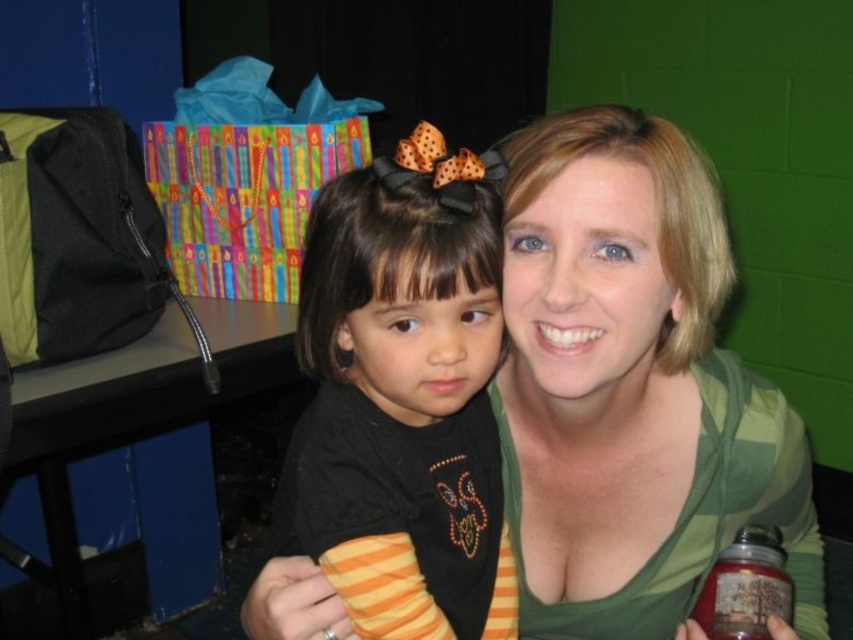
Question: Is green striped shirt at upper center below black matte shirt at center?

Choices:
 (A) yes
 (B) no

Answer: (A)

Question: Which of the following is the closest to the observer?

Choices:
 (A) green striped shirt at upper center
 (B) black matte shirt at center

Answer: (B)

Question: Is green striped shirt at upper center smaller than black matte shirt at center?

Choices:
 (A) yes
 (B) no

Answer: (B)

Question: Among these points, which one is nearest to the camera?

Choices:
 (A) (399, 541)
 (B) (509, 228)

Answer: (A)

Question: Does green striped shirt at upper center appear on the right side of black matte shirt at center?

Choices:
 (A) yes
 (B) no

Answer: (A)